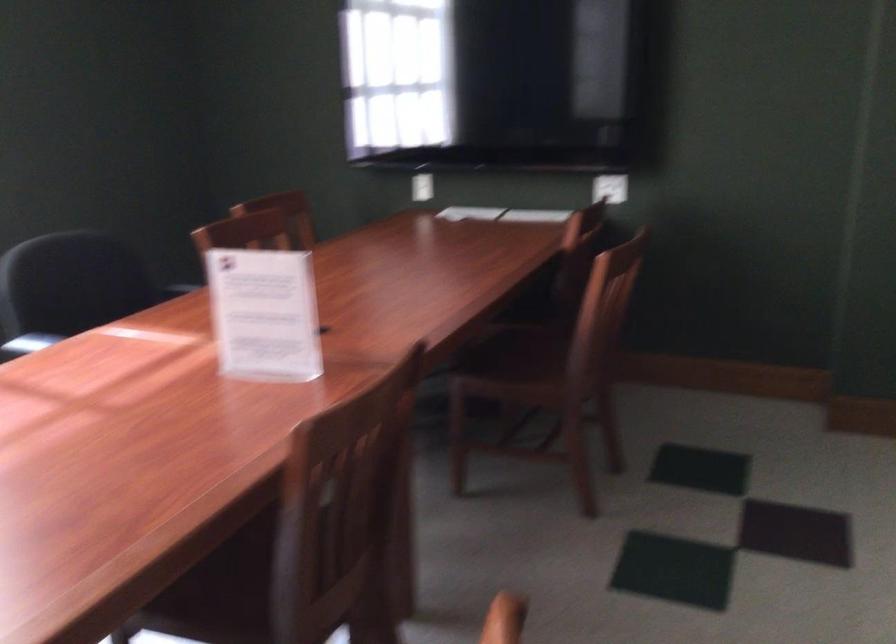
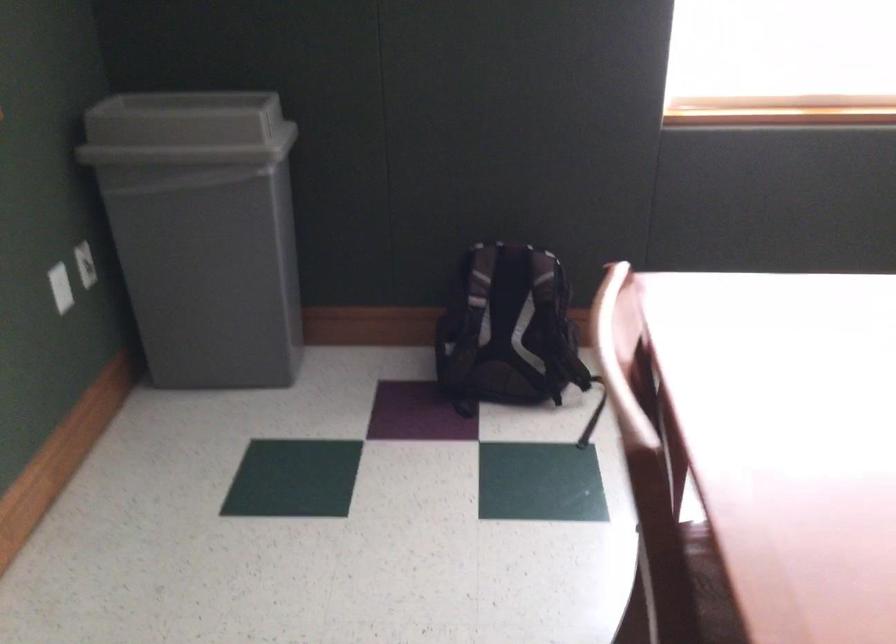
The first image is from the beginning of the video and the second image is from the end. How did the camera likely rotate when shooting the video?

The rotation direction of the camera is left-down.